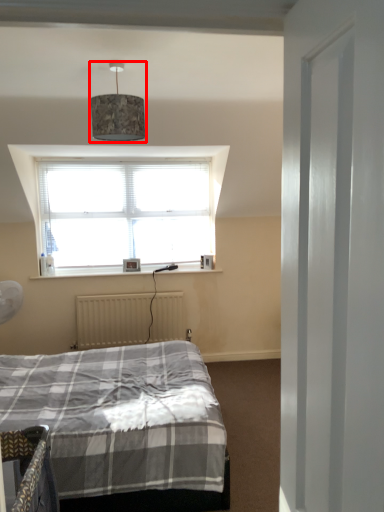
Question: Considering the relative positions of lamp (annotated by the red box) and radiator in the image provided, where is lamp (annotated by the red box) located with respect to the staircase?

Choices:
 (A) right
 (B) left

Answer: (A)